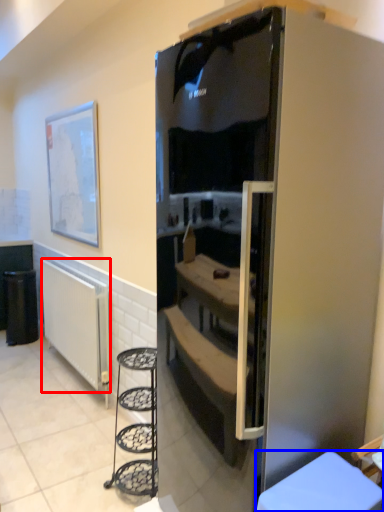
Question: Which object appears closest to the camera in this image, radiator (highlighted by a red box) or furniture (highlighted by a blue box)?

Choices:
 (A) radiator
 (B) furniture

Answer: (B)